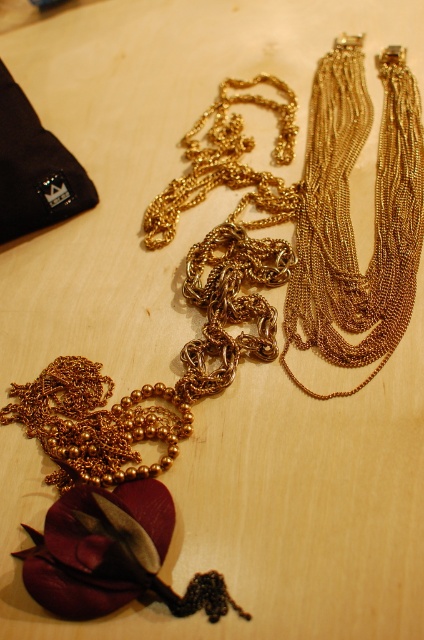
Question: Does gold chain at upper right have a greater width compared to satin burgundy flower at center?

Choices:
 (A) yes
 (B) no

Answer: (A)

Question: Among these objects, which one is farthest from the camera?

Choices:
 (A) gold chain at upper right
 (B) satin burgundy flower at center

Answer: (A)

Question: Can you confirm if gold chain at upper right is bigger than satin burgundy flower at center?

Choices:
 (A) no
 (B) yes

Answer: (B)

Question: Which object is closer to the camera taking this photo?

Choices:
 (A) gold chain at upper right
 (B) satin burgundy flower at center

Answer: (B)

Question: Can you confirm if gold chain at upper right is wider than satin burgundy flower at center?

Choices:
 (A) no
 (B) yes

Answer: (B)

Question: Which point is closer to the camera taking this photo?

Choices:
 (A) tap(88, 611)
 (B) tap(315, 97)

Answer: (A)